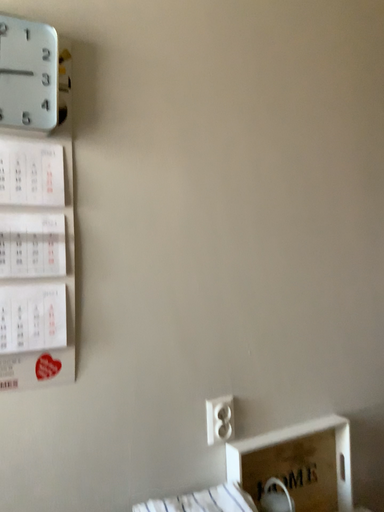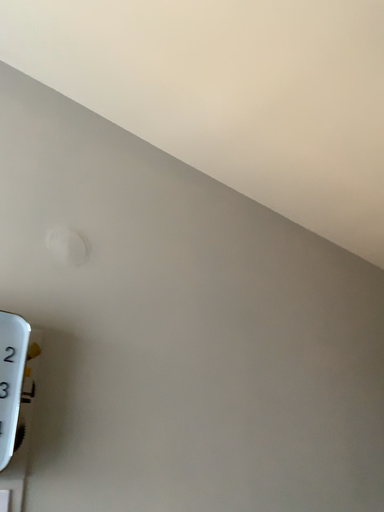
Question: How did the camera likely rotate when shooting the video?

Choices:
 (A) rotated left
 (B) rotated right

Answer: (B)